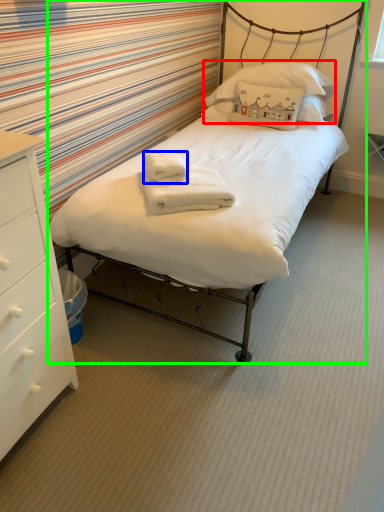
Question: Based on their relative distances, which object is nearer to pillow (highlighted by a red box)? Choose from bath towel (highlighted by a blue box) and bed (highlighted by a green box).

Choices:
 (A) bath towel
 (B) bed

Answer: (B)